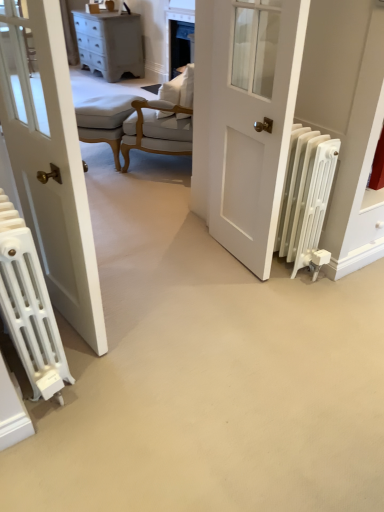
Where is `vacant space to the left of white matte radiator at right, which is the second radiator in left-to-right order`? The width and height of the screenshot is (384, 512). vacant space to the left of white matte radiator at right, which is the second radiator in left-to-right order is located at coordinates (228, 277).